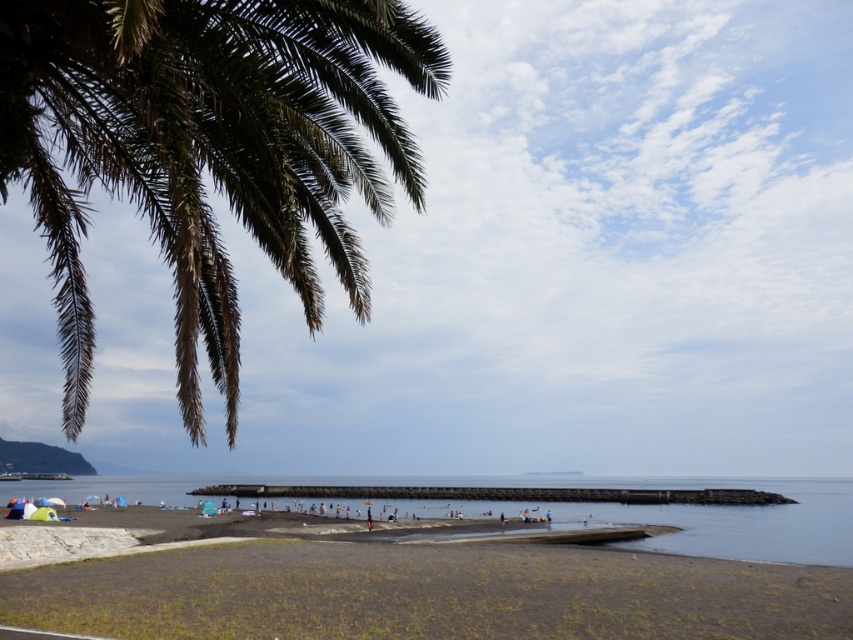
Question: Can you confirm if brown sand at lower center is positioned to the right of clear blue water at center?

Choices:
 (A) yes
 (B) no

Answer: (B)

Question: Is brown/dry palm leaves at upper left behind brown sand at lower center?

Choices:
 (A) yes
 (B) no

Answer: (B)

Question: Which object is positioned closest to the clear blue water at center?

Choices:
 (A) brown sand at lower center
 (B) brown/dry palm leaves at upper left

Answer: (A)

Question: Is brown sand at lower center positioned in front of clear blue water at center?

Choices:
 (A) no
 (B) yes

Answer: (B)

Question: Which object is farther from the camera taking this photo?

Choices:
 (A) clear blue water at center
 (B) brown/dry palm leaves at upper left
 (C) brown sand at lower center

Answer: (A)

Question: Which of the following is the closest to the observer?

Choices:
 (A) [x=447, y=596]
 (B) [x=685, y=486]
 (C) [x=62, y=333]

Answer: (A)